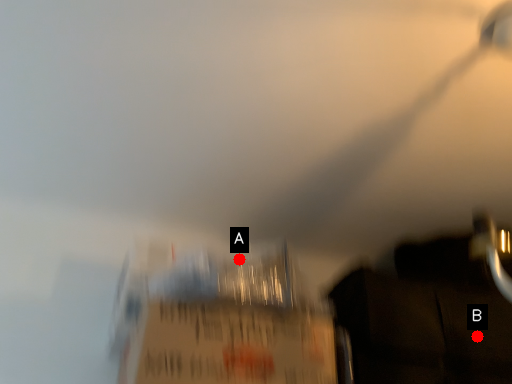
Question: Two points are circled on the image, labeled by A and B beside each circle. Which point appears farthest from the camera in this image?

Choices:
 (A) A is further
 (B) B is further

Answer: (B)